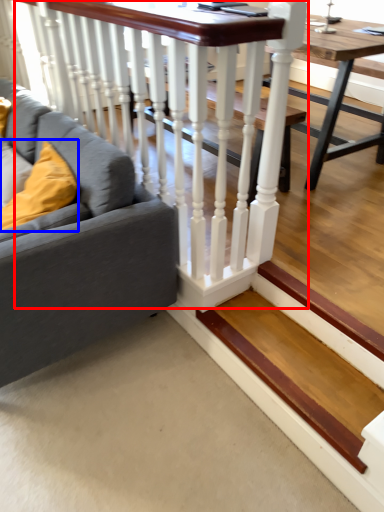
Question: Which object is further to the camera taking this photo, rail (highlighted by a red box) or pillow (highlighted by a blue box)?

Choices:
 (A) rail
 (B) pillow

Answer: (B)